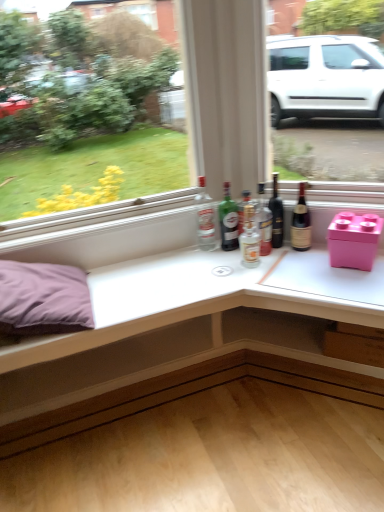
The height and width of the screenshot is (512, 384). In order to click on vacant space in front of dark glass bottle at center in this screenshot , I will do `click(281, 261)`.